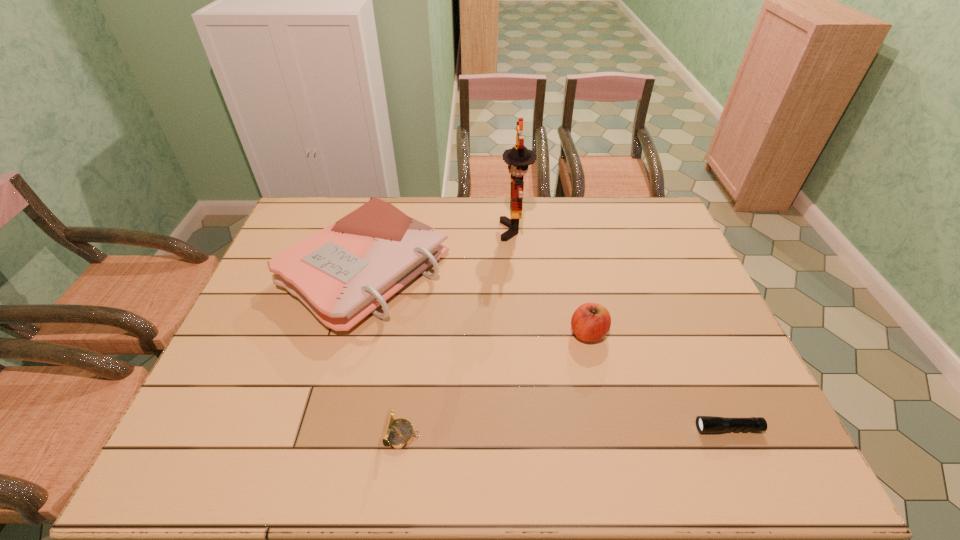
The image size is (960, 540). Find the location of `nutcracker`. nutcracker is located at coordinates (519, 157).

Find the location of a particular element. This screenshot has height=540, width=960. the third object from right to left is located at coordinates (519, 157).

The width and height of the screenshot is (960, 540). In order to click on phonebook in this screenshot , I will do [342, 273].

The image size is (960, 540). I want to click on the fourth object from left to right, so click(590, 322).

Where is `compass`? Image resolution: width=960 pixels, height=540 pixels. compass is located at coordinates (398, 433).

I want to click on the rightmost object, so click(705, 424).

This screenshot has width=960, height=540. Identify the location of flashlight. (705, 424).

Where is `blank space located 0.280m on the front-facing side of the third object from right to left`? The image size is (960, 540). blank space located 0.280m on the front-facing side of the third object from right to left is located at coordinates (420, 231).

The image size is (960, 540). In order to click on free space located 0.100m on the front-facing side of the third object from right to left in this screenshot , I will do `click(471, 231)`.

At what (x,y) coordinates should I click in order to perform the action: click on vacant space situated 0.070m on the front-facing side of the third object from right to left. Please return your answer as a coordinate pair (x, y). Looking at the image, I should click on (480, 231).